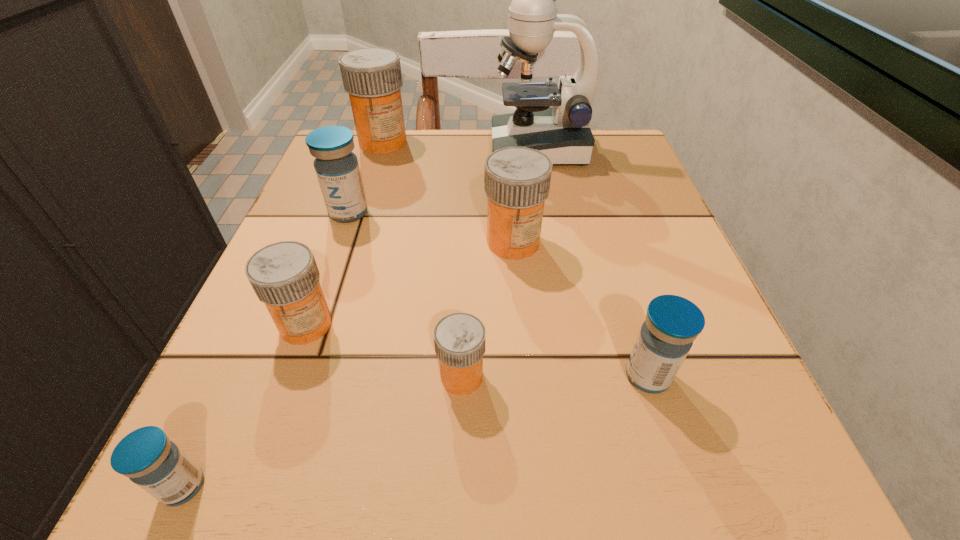
Locate an element on the screen. The width and height of the screenshot is (960, 540). vacant area that lies between the smallest orange medicine and the farthest blue medicine is located at coordinates (405, 295).

You are a GUI agent. You are given a task and a screenshot of the screen. Output one action in this format:
    pyautogui.click(x=<x>, y=<y>)
    Task: Click on the free spot between the leftmost blue medicine and the smallest orange medicine
    
    Given the screenshot: What is the action you would take?
    pyautogui.click(x=323, y=431)

You are a GUI agent. You are given a task and a screenshot of the screen. Output one action in this format:
    pyautogui.click(x=<x>, y=<y>)
    Task: Click on the vacant region between the farthest blue medicine and the second smallest orange medicine
    The image size is (960, 540).
    Given the screenshot: What is the action you would take?
    pyautogui.click(x=327, y=269)

Locate an element on the screen. vacant region between the tallest medicine and the third biggest orange medicine is located at coordinates (345, 233).

I want to click on free spot between the second tallest object and the smallest orange medicine, so click(422, 259).

Where is `vacant space that's between the tallest medicine and the third orange medicine from left to right`? vacant space that's between the tallest medicine and the third orange medicine from left to right is located at coordinates (422, 259).

Where is `free space between the leftmost blue medicine and the third orange medicine from left to right`? free space between the leftmost blue medicine and the third orange medicine from left to right is located at coordinates (323, 431).

Locate which object ranks seventh in proximity to the tallest medicine. Please provide its 2D coordinates. Your answer should be formatted as a tuple, i.e. [(x, y)], where the tuple contains the x and y coordinates of a point satisfying the conditions above.

[(157, 465)]

This screenshot has height=540, width=960. I want to click on object that can be found as the fifth closest to the nearest blue medicine, so click(x=672, y=323).

Point out which medicine is positioned as the sixth nearest to the tallest medicine. Please provide its 2D coordinates. Your answer should be formatted as a tuple, i.e. [(x, y)], where the tuple contains the x and y coordinates of a point satisfying the conditions above.

[(157, 465)]